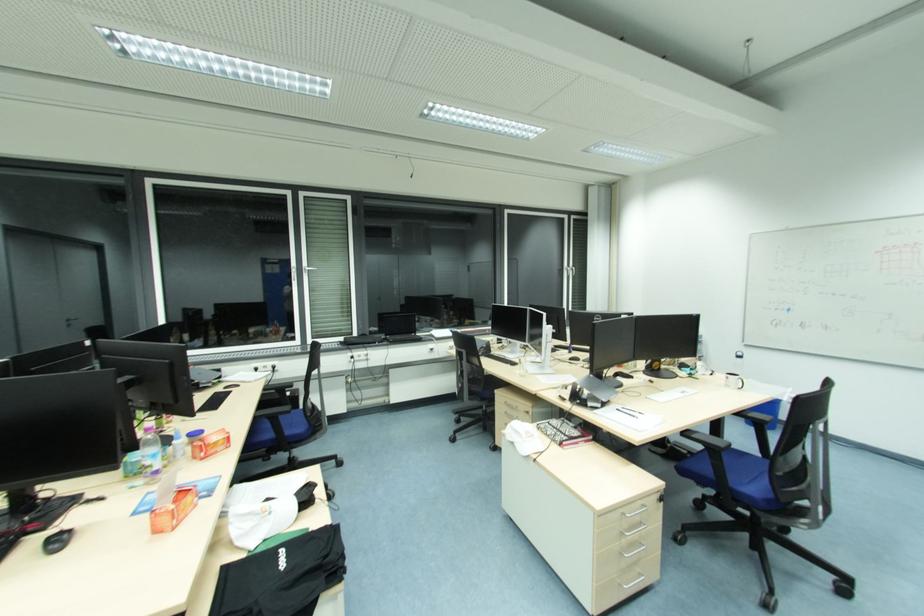
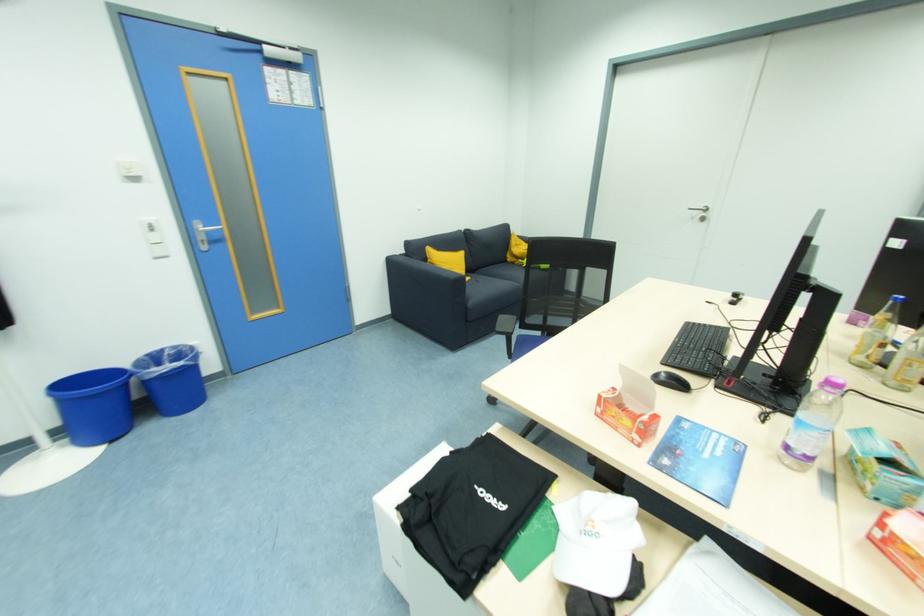
In the second image, find the point that corresponds to the point at 159,474 in the first image.

(792, 448)